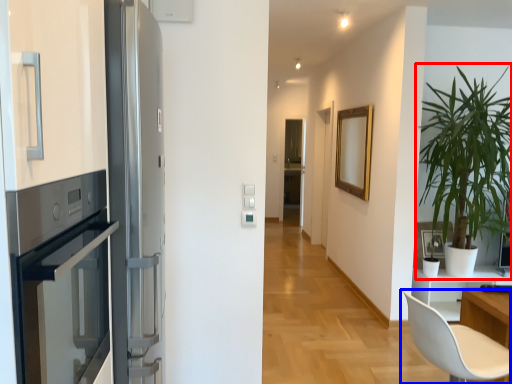
Question: Among these objects, which one is farthest to the camera, houseplant (highlighted by a red box) or chair (highlighted by a blue box)?

Choices:
 (A) houseplant
 (B) chair

Answer: (A)